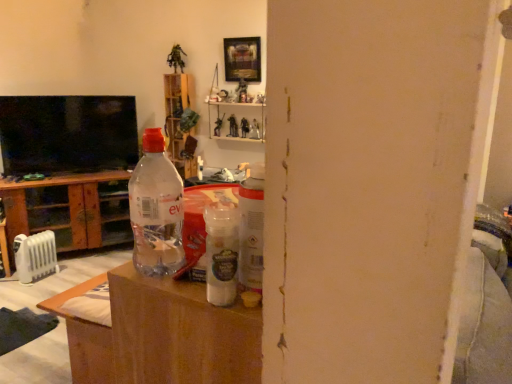
The height and width of the screenshot is (384, 512). I want to click on wooden shelf at upper center, so click(179, 120).

In order to face black glossy tv at upper left, should I rotate leftwards or rightwards?

Rotate your view left by about 23.135°.

This screenshot has height=384, width=512. In order to click on wooden shelf at upper center in this screenshot , I will do `click(179, 120)`.

From a real-world perspective, is wooden picture frame at upper center physically located above or below transparent plastic cabinet at left?

wooden picture frame at upper center is situated higher than transparent plastic cabinet at left in the real world.

Is wooden picture frame at upper center taller than transparent plastic cabinet at left?

Incorrect, the height of wooden picture frame at upper center is not larger of that of transparent plastic cabinet at left.

Is point (246, 55) positioned in front of point (28, 207)?

That is True.

Considering the relative positions of wooden picture frame at upper center and transparent plastic cabinet at left in the image provided, is wooden picture frame at upper center to the left or to the right of transparent plastic cabinet at left?

From the image, it's evident that wooden picture frame at upper center is to the right of transparent plastic cabinet at left.

Is transparent plastic cabinet at left inside the boundaries of wooden shelf at upper center, or outside?

The correct answer is: outside.

Which object is thinner, transparent plastic cabinet at left or wooden shelf at upper center?

With smaller width is wooden shelf at upper center.

Based on the photo, considering the positions of objects transparent plastic cabinet at left and wooden shelf at upper center in the image provided, who is more to the right, transparent plastic cabinet at left or wooden shelf at upper center?

wooden shelf at upper center is more to the right.

Does wooden shelf at upper center have a greater width compared to wooden picture frame at upper center?

Yes.

Is wooden shelf at upper center aimed at wooden picture frame at upper center?

No, wooden shelf at upper center is not turned towards wooden picture frame at upper center.

From a real-world perspective, is wooden shelf at upper center on wooden picture frame at upper center?

No.

Can we say wooden picture frame at upper center lies outside wooden shelf at upper center?

Yes, wooden picture frame at upper center is located beyond the bounds of wooden shelf at upper center.

Considering the sizes of objects wooden picture frame at upper center and wooden shelf at upper center in the image provided, who is shorter, wooden picture frame at upper center or wooden shelf at upper center?

With less height is wooden picture frame at upper center.

In the scene shown: Considering the sizes of objects wooden picture frame at upper center and wooden shelf at upper center in the image provided, who is thinner, wooden picture frame at upper center or wooden shelf at upper center?

With smaller width is wooden picture frame at upper center.

How much distance is there between white plastic radiator at lower left and wooden shelf at upper center?

The distance of white plastic radiator at lower left from wooden shelf at upper center is 4.53 feet.

Considering the sizes of white plastic radiator at lower left and wooden shelf at upper center in the image, is white plastic radiator at lower left taller or shorter than wooden shelf at upper center?

white plastic radiator at lower left is shorter than wooden shelf at upper center.

Considering the relative sizes of white plastic radiator at lower left and wooden shelf at upper center in the image provided, is white plastic radiator at lower left bigger than wooden shelf at upper center?

No.

Identify the location of appliance that appears below the wooden shelf at upper center (from a real-world perspective). The width and height of the screenshot is (512, 384). (35, 256).

The height and width of the screenshot is (384, 512). What are the coordinates of `bottle on the right of transparent plastic cabinet at left` in the screenshot? It's located at (156, 209).

Between transparent plastic cabinet at left and transparent plastic bottle at center, which one has larger width?

With larger width is transparent plastic cabinet at left.

Which is correct: transparent plastic cabinet at left is inside transparent plastic bottle at center, or outside of it?

The correct answer is: outside.

Is transparent plastic cabinet at left to the right of transparent plastic bottle at center from the viewer's perspective?

Incorrect, transparent plastic cabinet at left is not on the right side of transparent plastic bottle at center.

Which of these two, wooden shelf at upper center or black glossy tv at upper left, is smaller?

wooden shelf at upper center.

Is black glossy tv at upper left located within wooden shelf at upper center?

No, wooden shelf at upper center does not contain black glossy tv at upper left.

Could you tell me if wooden shelf at upper center is turned towards black glossy tv at upper left?

No, wooden shelf at upper center does not turn towards black glossy tv at upper left.

Between wooden shelf at upper center and black glossy tv at upper left, which one has less height?

Standing shorter between the two is black glossy tv at upper left.

Locate an element on the screen. The width and height of the screenshot is (512, 384). picture frame behind the transparent plastic cabinet at left is located at coordinates (242, 59).

Where is `cabinetry below the wooden shelf at upper center (from a real-world perspective)`? The width and height of the screenshot is (512, 384). cabinetry below the wooden shelf at upper center (from a real-world perspective) is located at coordinates (71, 209).

From the picture: Which object lies further to the anchor point wooden picture frame at upper center, wooden shelf at upper center or transparent plastic bottle at center?

Based on the image, transparent plastic bottle at center appears to be further to wooden picture frame at upper center.

Which object lies further to the anchor point transparent plastic bottle at center, wooden shelf at upper center or wooden picture frame at upper center?

wooden shelf at upper center is positioned further to the anchor transparent plastic bottle at center.

When comparing their distances from transparent plastic cabinet at left, does black glossy tv at upper left or transparent plastic bottle at center seem closer?

black glossy tv at upper left is closer to transparent plastic cabinet at left.

From the image, which object appears to be nearer to transparent plastic cabinet at left, wooden shelf at upper center or black glossy tv at upper left?

black glossy tv at upper left is positioned closer to the anchor transparent plastic cabinet at left.

When comparing their distances from white plastic radiator at lower left, does wooden picture frame at upper center or wooden shelf at upper center seem further?

Among the two, wooden picture frame at upper center is located further to white plastic radiator at lower left.

From the image, which object appears to be nearer to transparent plastic bottle at center, black glossy tv at upper left or white plastic radiator at lower left?

The object closer to transparent plastic bottle at center is white plastic radiator at lower left.

Which object lies nearer to the anchor point wooden picture frame at upper center, wooden shelf at upper center or white plastic radiator at lower left?

wooden shelf at upper center lies closer to wooden picture frame at upper center than the other object.

Looking at the image, which one is located further to white plastic radiator at lower left, wooden shelf at upper center or wooden picture frame at upper center?

Based on the image, wooden picture frame at upper center appears to be further to white plastic radiator at lower left.

At what (x,y) coordinates should I click in order to perform the action: click on television between transparent plastic bottle at center and wooden picture frame at upper center from front to back. Please return your answer as a coordinate pair (x, y). Looking at the image, I should click on (67, 134).

Where is `cabinetry that lies between black glossy tv at upper left and white plastic radiator at lower left from top to bottom`? This screenshot has height=384, width=512. cabinetry that lies between black glossy tv at upper left and white plastic radiator at lower left from top to bottom is located at coordinates (71, 209).

In order to click on appliance between transparent plastic bottle at center and black glossy tv at upper left in the front-back direction in this screenshot , I will do `click(35, 256)`.

You are a GUI agent. You are given a task and a screenshot of the screen. Output one action in this format:
    pyautogui.click(x=<x>, y=<y>)
    Task: Click on the cabinetry between white plastic radiator at lower left and wooden picture frame at upper center from left to right
    The image size is (512, 384).
    Given the screenshot: What is the action you would take?
    pos(71,209)